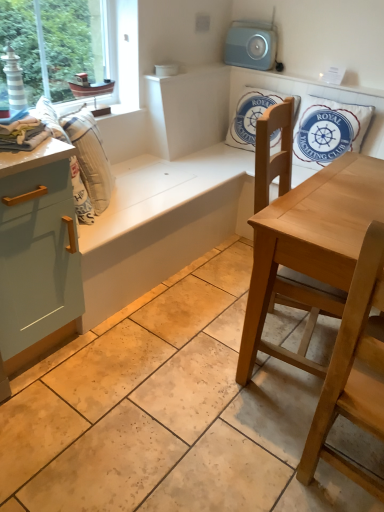
Question: Looking at the image, does white cotton cushion at upper right, the 1th pillow viewed from the right, seem bigger or smaller compared to light blue matte cabinet at left?

Choices:
 (A) big
 (B) small

Answer: (B)

Question: Would you say white cotton cushion at upper right, arranged as the second pillow when viewed from the left, is inside or outside light blue matte cabinet at left?

Choices:
 (A) inside
 (B) outside

Answer: (B)

Question: Estimate the real-world distances between objects in this image. Which object is closer to the light wood chair at lower right, acting as the 2th chair starting from the back?

Choices:
 (A) white cotton cushion at upper right, the 1th pillow viewed from the right
 (B) light wood chair at center, which is the first chair in back-to-front order
 (C) light blue matte cabinet at left
 (D) white cotton cushion at upper center, arranged as the first pillow when viewed from the left
 (E) light blue plastic radio at upper center

Answer: (B)

Question: Based on their relative distances, which object is farther from the light wood chair at lower right, marked as the 1th chair in a front-to-back arrangement?

Choices:
 (A) white cotton cushion at upper right, the 1th pillow viewed from the right
 (B) white striped fabric at left
 (C) white cotton towel at left
 (D) light blue matte cabinet at left
 (E) light wood chair at center, which is the first chair in back-to-front order

Answer: (A)